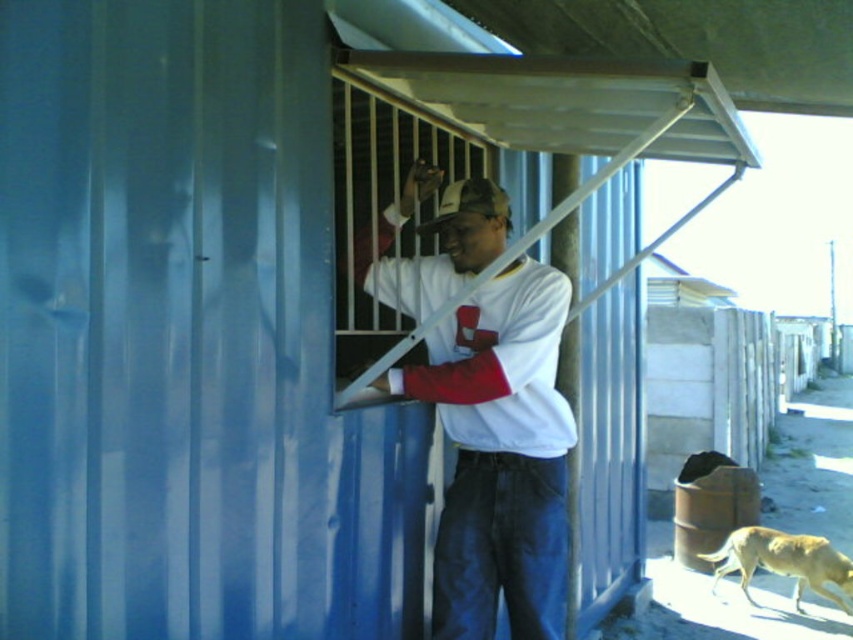
You are a drone operator trying to capture a photo of the white matte shirt at center. The drone is currently at a position above the blue corrugated metal structure. To ensure the shirt is in the frame, where should the drone adjust its camera angle relative to the structure?

The white matte shirt at center is located at coordinates 0.713 on the x axis and 0.586 on the y axis, so the drone should adjust its camera angle to face slightly to the right and down relative to the blue corrugated metal structure to capture the shirt in the frame.